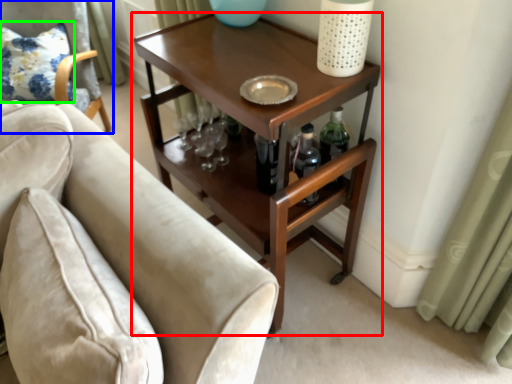
Question: Which is nearer to the table (highlighted by a red box)? chair (highlighted by a blue box) or pillow (highlighted by a green box).

Choices:
 (A) chair
 (B) pillow

Answer: (A)